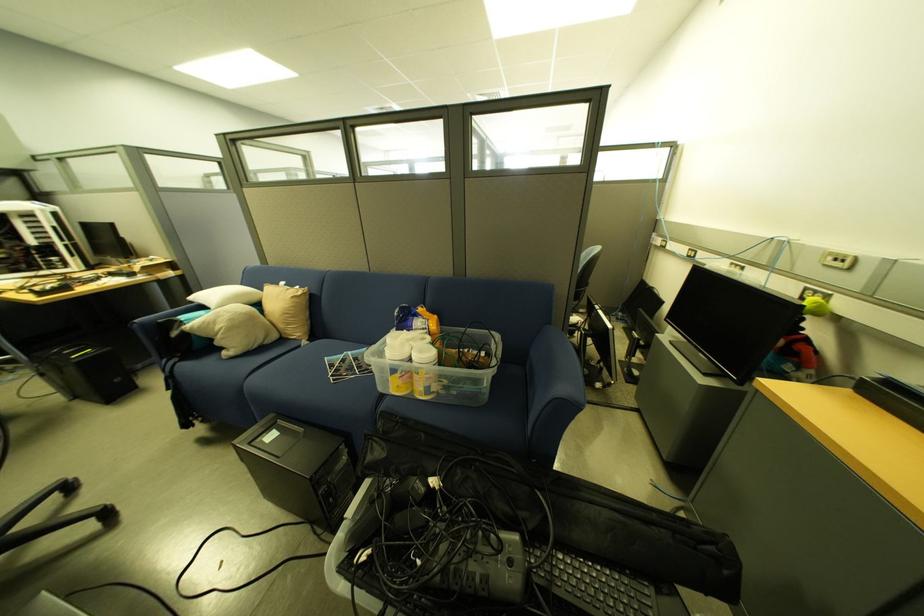
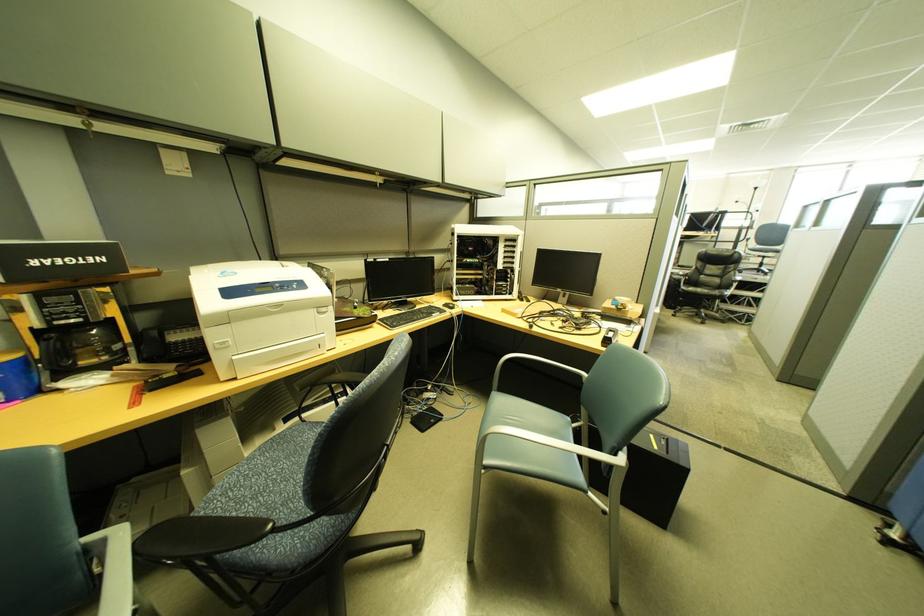
Question: What movement of the cameraman would produce the second image?

Choices:
 (A) Left
 (B) Right
 (C) Forward
 (D) Backward

Answer: (A)